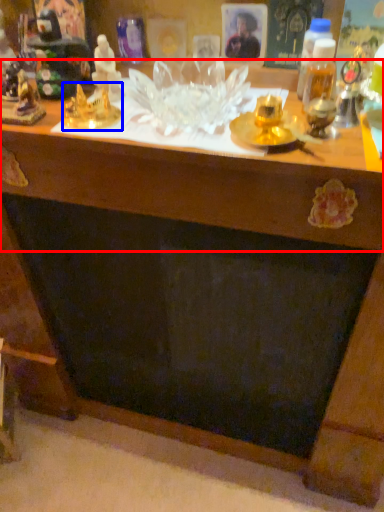
Question: Among these objects, which one is farthest to the camera, table (highlighted by a red box) or toy (highlighted by a blue box)?

Choices:
 (A) table
 (B) toy

Answer: (B)